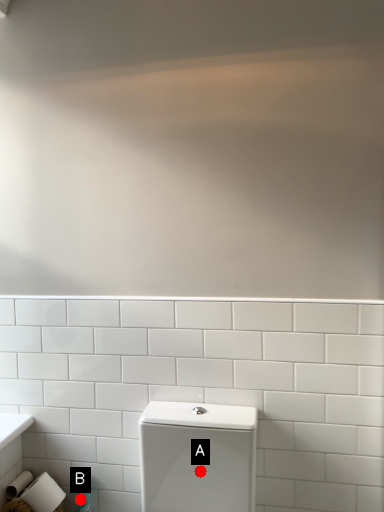
Question: Two points are circled on the image, labeled by A and B beside each circle. Which point is closer to the camera?

Choices:
 (A) A is closer
 (B) B is closer

Answer: (A)